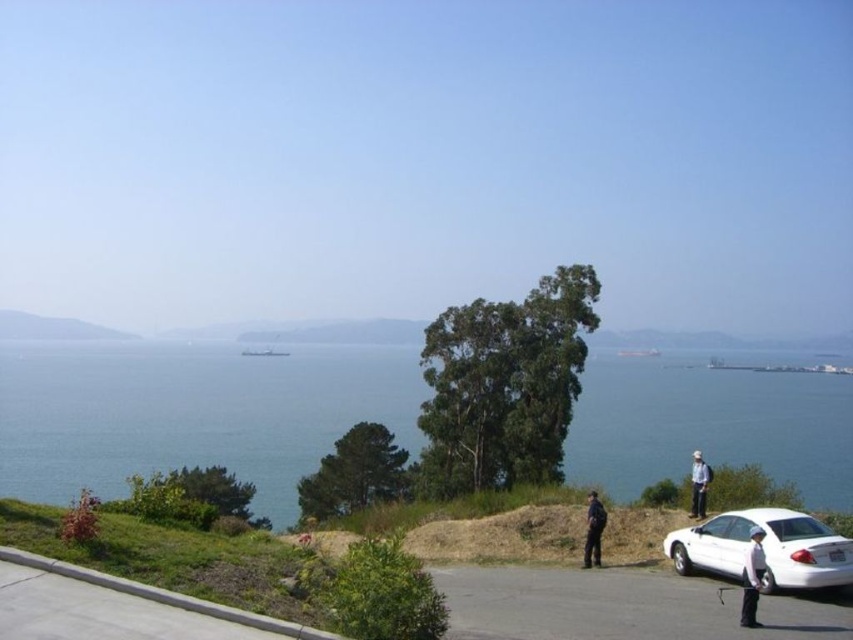
Does white matte shirt at lower right have a greater width compared to white fabric shirt at lower right?

No.

Does white matte shirt at lower right appear over white fabric shirt at lower right?

Yes, white matte shirt at lower right is above white fabric shirt at lower right.

Which is in front, point (753, 596) or point (698, 464)?

Point (753, 596) is in front.

The image size is (853, 640). Find the location of `white matte shirt at lower right`. white matte shirt at lower right is located at coordinates (752, 577).

Between blue water at center and black uniform at center, which one has less height?

With less height is black uniform at center.

Is point (368, 408) behind point (589, 497)?

Yes, point (368, 408) is farther from viewer.

Locate an element on the screen. blue water at center is located at coordinates (190, 413).

What do you see at coordinates (190, 413) in the screenshot? I see `blue water at center` at bounding box center [190, 413].

Which is above, blue water at center or white matte shirt at lower right?

white matte shirt at lower right is higher up.

Which is behind, point (621, 458) or point (751, 579)?

The point (621, 458) is more distant.

Where is `blue water at center`? This screenshot has width=853, height=640. blue water at center is located at coordinates (190, 413).